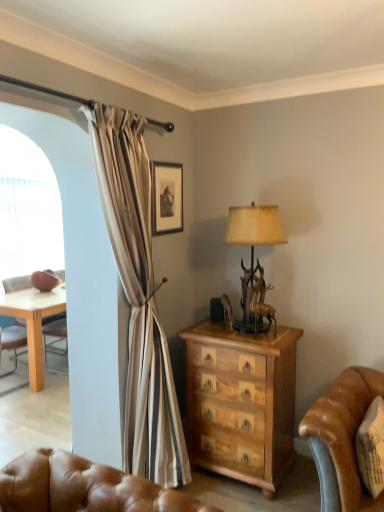
What do you see at coordinates (254, 227) in the screenshot?
I see `antique brass lamp at center` at bounding box center [254, 227].

Locate an element on the screen. Image resolution: width=384 pixels, height=512 pixels. wooden chest of drawers at center is located at coordinates (241, 402).

What do you see at coordinates (28, 210) in the screenshot?
I see `transparent plastic screen at left` at bounding box center [28, 210].

Where is `matte black picture frame at upper center`? This screenshot has width=384, height=512. matte black picture frame at upper center is located at coordinates (167, 198).

Considering the sizes of objects antique brass lamp at center and transparent plastic screen at left in the image provided, who is wider, antique brass lamp at center or transparent plastic screen at left?

Wider between the two is antique brass lamp at center.

From a real-world perspective, is antique brass lamp at center physically above transparent plastic screen at left?

Incorrect, from a real-world perspective, antique brass lamp at center is lower than transparent plastic screen at left.

Is point (235, 221) behind point (11, 130)?

No, it is not.

Is antique brass lamp at center oriented towards transparent plastic screen at left?

No, antique brass lamp at center is not facing towards transparent plastic screen at left.

Are matte black picture frame at upper center and antique brass lamp at center located far from each other?

Actually, matte black picture frame at upper center and antique brass lamp at center are a little close together.

Is matte black picture frame at upper center oriented towards antique brass lamp at center?

Yes, matte black picture frame at upper center faces towards antique brass lamp at center.

Is matte black picture frame at upper center bigger or smaller than antique brass lamp at center?

Considering their sizes, matte black picture frame at upper center takes up less space than antique brass lamp at center.

Is transparent plastic screen at left facing towards wooden chest of drawers at center?

Yes, transparent plastic screen at left is facing wooden chest of drawers at center.

Is transparent plastic screen at left not inside wooden chest of drawers at center?

Yes, transparent plastic screen at left is not within wooden chest of drawers at center.

From the picture: Considering the sizes of objects transparent plastic screen at left and wooden chest of drawers at center in the image provided, who is bigger, transparent plastic screen at left or wooden chest of drawers at center?

wooden chest of drawers at center.

Is point (53, 203) closer to viewer compared to point (212, 380)?

No, (53, 203) is further to viewer.

From the image's perspective, between transparent plastic screen at left and matte black picture frame at upper center, who is located below?

From the image's view, transparent plastic screen at left is below.

Considering the sizes of objects transparent plastic screen at left and matte black picture frame at upper center in the image provided, who is taller, transparent plastic screen at left or matte black picture frame at upper center?

transparent plastic screen at left.

Considering the positions of objects transparent plastic screen at left and matte black picture frame at upper center in the image provided, who is more to the right, transparent plastic screen at left or matte black picture frame at upper center?

Positioned to the right is matte black picture frame at upper center.

Is transparent plastic screen at left located outside matte black picture frame at upper center?

That's correct, transparent plastic screen at left is outside of matte black picture frame at upper center.

Considering the relative positions of antique brass lamp at center and wooden chest of drawers at center in the image provided, is antique brass lamp at center to the right of wooden chest of drawers at center from the viewer's perspective?

Yes, antique brass lamp at center is to the right of wooden chest of drawers at center.

Is antique brass lamp at center facing away from wooden chest of drawers at center?

No, antique brass lamp at center's orientation is not away from wooden chest of drawers at center.

From the picture: Which object is closer to the camera, antique brass lamp at center or wooden chest of drawers at center?

wooden chest of drawers at center is more forward.

Are antique brass lamp at center and wooden chest of drawers at center making contact?

antique brass lamp at center is not next to wooden chest of drawers at center, and they're not touching.

From a real-world perspective, who is located higher, wooden chest of drawers at center or antique brass lamp at center?

antique brass lamp at center is physically above.

You are a GUI agent. You are given a task and a screenshot of the screen. Output one action in this format:
    pyautogui.click(x=<x>, y=<y>)
    Task: Click on the lamp on the right of wooden chest of drawers at center
    
    Given the screenshot: What is the action you would take?
    pyautogui.click(x=254, y=227)

Who is shorter, wooden chest of drawers at center or transparent plastic screen at left?

wooden chest of drawers at center is shorter.

Who is bigger, wooden chest of drawers at center or transparent plastic screen at left?

wooden chest of drawers at center.

Between wooden chest of drawers at center and transparent plastic screen at left, which one has smaller width?

With smaller width is transparent plastic screen at left.

The image size is (384, 512). I want to click on window screen behind the antique brass lamp at center, so click(28, 210).

Identify the location of picture frame above the antique brass lamp at center (from a real-world perspective). This screenshot has height=512, width=384. (167, 198).

In the scene shown: When comparing their distances from matte black picture frame at upper center, does wooden chest of drawers at center or antique brass lamp at center seem further?

wooden chest of drawers at center is positioned further to the anchor matte black picture frame at upper center.

Looking at the image, which one is located closer to wooden chest of drawers at center, antique brass lamp at center or matte black picture frame at upper center?

antique brass lamp at center.

Based on their spatial positions, is wooden chest of drawers at center or transparent plastic screen at left closer to antique brass lamp at center?

The object closer to antique brass lamp at center is wooden chest of drawers at center.

When comparing their distances from transparent plastic screen at left, does wooden chest of drawers at center or matte black picture frame at upper center seem closer?

Based on the image, matte black picture frame at upper center appears to be nearer to transparent plastic screen at left.

Based on their spatial positions, is antique brass lamp at center or transparent plastic screen at left closer to matte black picture frame at upper center?

antique brass lamp at center is closer to matte black picture frame at upper center.

When comparing their distances from transparent plastic screen at left, does wooden chest of drawers at center or antique brass lamp at center seem further?

antique brass lamp at center.

From the image, which object appears to be nearer to transparent plastic screen at left, antique brass lamp at center or matte black picture frame at upper center?

matte black picture frame at upper center is positioned closer to the anchor transparent plastic screen at left.

From the image, which object appears to be nearer to antique brass lamp at center, matte black picture frame at upper center or transparent plastic screen at left?

Among the two, matte black picture frame at upper center is located nearer to antique brass lamp at center.

Where is `lamp between matte black picture frame at upper center and wooden chest of drawers at center in the up-down direction`? lamp between matte black picture frame at upper center and wooden chest of drawers at center in the up-down direction is located at coordinates (254, 227).

Find the location of `picture frame located between wooden chest of drawers at center and transparent plastic screen at left in the depth direction`. picture frame located between wooden chest of drawers at center and transparent plastic screen at left in the depth direction is located at coordinates [167, 198].

Where is `picture frame between antique brass lamp at center and transparent plastic screen at left in the front-back direction`? picture frame between antique brass lamp at center and transparent plastic screen at left in the front-back direction is located at coordinates (167, 198).

What are the coordinates of `lamp between wooden chest of drawers at center and transparent plastic screen at left from front to back` in the screenshot? It's located at (254, 227).